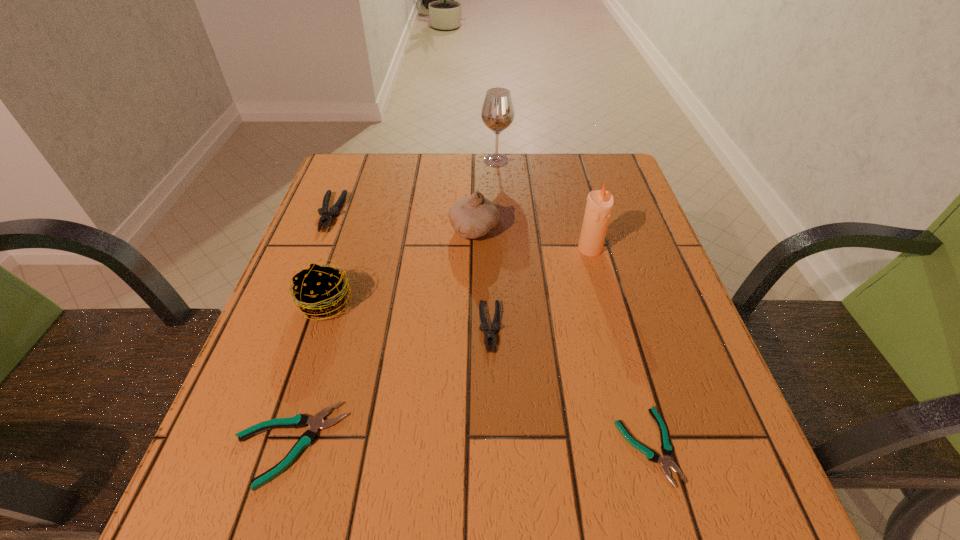
What are the coordinates of `the rightmost pliers` in the screenshot? It's located at (665, 461).

Find the location of `the smaller teal pliers`. the smaller teal pliers is located at coordinates (665, 461).

The width and height of the screenshot is (960, 540). In order to click on vacant space located on the front of the wineglass in this screenshot , I will do `click(499, 220)`.

At what (x,y) coordinates should I click in order to perform the action: click on free spot located on the left of the candle. Please return your answer as a coordinate pair (x, y). Looking at the image, I should click on (539, 249).

Identify the location of vacant area situated on the front of the sixth shortest object. The image size is (960, 540). (472, 328).

You are a GUI agent. You are given a task and a screenshot of the screen. Output one action in this format:
    pyautogui.click(x=<x>, y=<y>)
    Task: Click on the free region located on the back of the fifth shortest object
    This screenshot has height=540, width=960.
    Given the screenshot: What is the action you would take?
    pyautogui.click(x=349, y=232)

Locate an element on the screen. The image size is (960, 540). vacant space located 0.080m at the gripping part of the bigger gray pliers is located at coordinates (314, 257).

At what (x,y) coordinates should I click in order to perform the action: click on vacant space situated 0.250m at the gripping part of the sixth tallest object. Please return your answer as a coordinate pair (x, y). This screenshot has width=960, height=540. Looking at the image, I should click on (493, 500).

Locate an element on the screen. vacant space located 0.100m on the back of the bigger teal pliers is located at coordinates (317, 354).

Image resolution: width=960 pixels, height=540 pixels. I want to click on vacant space located 0.080m on the left of the shortest pliers, so click(x=567, y=446).